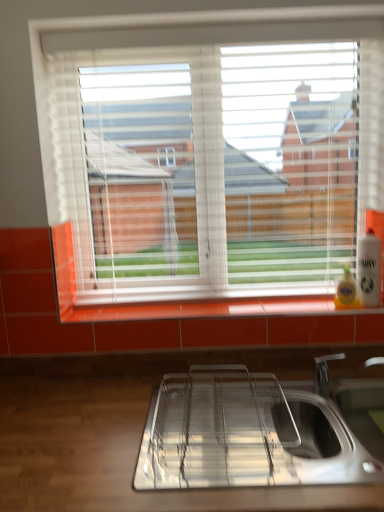
The height and width of the screenshot is (512, 384). Find the location of `blank space to the left of white plastic bottle at right`. blank space to the left of white plastic bottle at right is located at coordinates (309, 301).